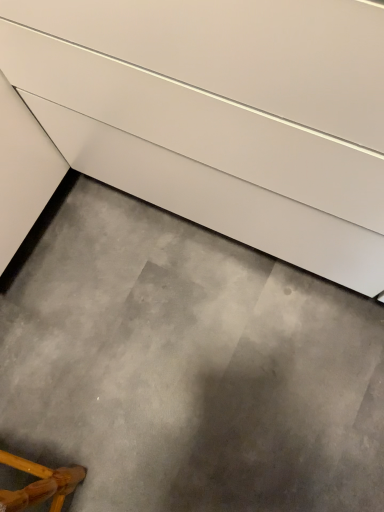
Question: Considering the positions of gray concrete at lower center and wooden chair at lower left in the image, is gray concrete at lower center bigger or smaller than wooden chair at lower left?

Choices:
 (A) small
 (B) big

Answer: (A)

Question: Considering the positions of point (144, 452) and point (38, 492), is point (144, 452) closer or farther from the camera than point (38, 492)?

Choices:
 (A) farther
 (B) closer

Answer: (A)

Question: Which object is the farthest from the white glossy drawer at upper center?

Choices:
 (A) gray concrete at lower center
 (B) wooden chair at lower left

Answer: (B)

Question: Estimate the real-world distances between objects in this image. Which object is closer to the white glossy drawer at upper center?

Choices:
 (A) gray concrete at lower center
 (B) wooden chair at lower left

Answer: (A)